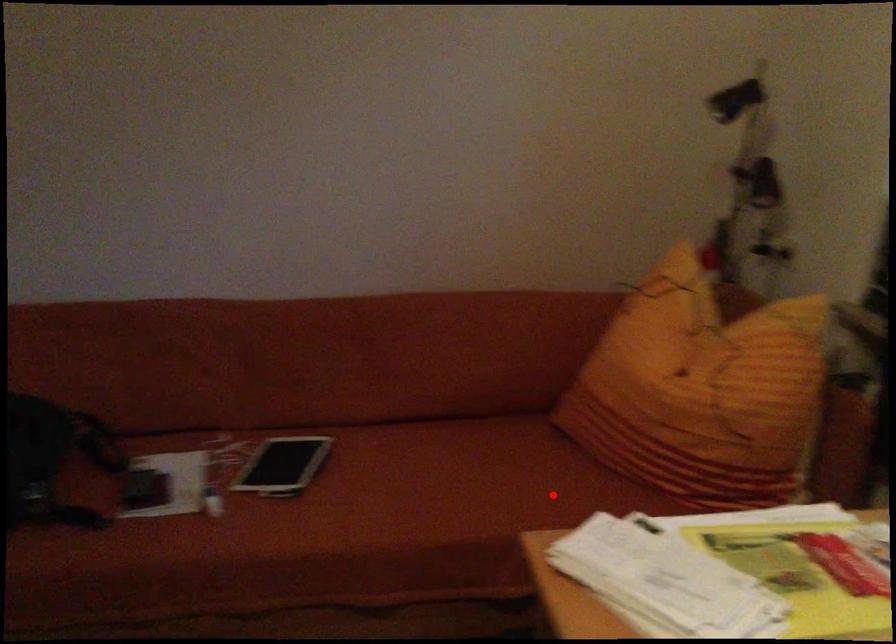
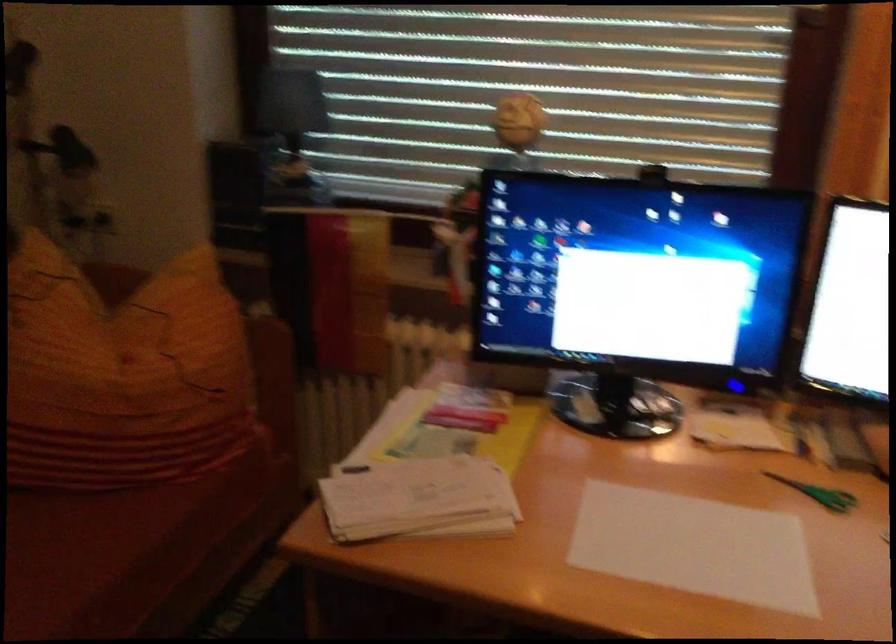
Question: A red point is marked in image1. In image2, is the corresponding 3D point closer to the camera or farther? Reply with the corresponding letter.

Choices:
 (A) The corresponding 3D point is closer.
 (B) The corresponding 3D point is farther.

Answer: (A)